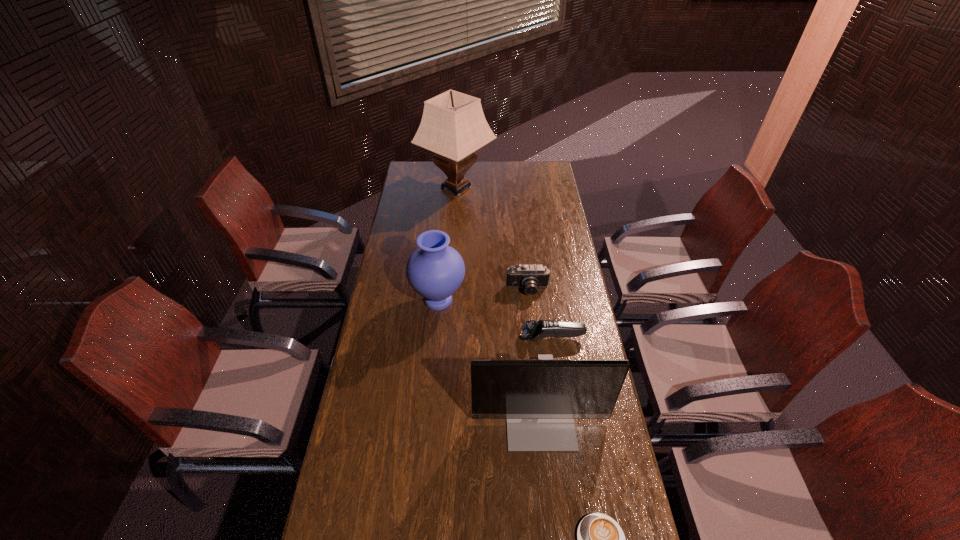
Find the location of a particular element. The height and width of the screenshot is (540, 960). object positioned at the far left corner is located at coordinates (453, 125).

Locate an element on the screen. vacant point at the far edge is located at coordinates (479, 174).

Identify the location of free spot at the left edge of the desktop. The width and height of the screenshot is (960, 540). (398, 418).

In the image, there is a desktop. In order to click on vacant space at the right edge in this screenshot , I will do `click(545, 202)`.

Where is `free space between the vase and the fifth farthest object`? free space between the vase and the fifth farthest object is located at coordinates (490, 360).

Locate an element on the screen. This screenshot has width=960, height=540. free space that is in between the vase and the fourth farthest object is located at coordinates (495, 319).

What are the coordinates of `unoccupied position between the tallest object and the fifth farthest object` in the screenshot? It's located at (498, 303).

At what (x,y) coordinates should I click in order to perform the action: click on unoccupied area between the farthest object and the fifth farthest object. Please return your answer as a coordinate pair (x, y). This screenshot has height=540, width=960. Looking at the image, I should click on (498, 303).

At what (x,y) coordinates should I click in order to perform the action: click on empty space that is in between the tallest object and the second shortest object. Please return your answer as a coordinate pair (x, y). This screenshot has height=540, width=960. Looking at the image, I should click on (505, 262).

Where is `vacant area that lies between the lampshade and the camera`? Image resolution: width=960 pixels, height=540 pixels. vacant area that lies between the lampshade and the camera is located at coordinates (492, 239).